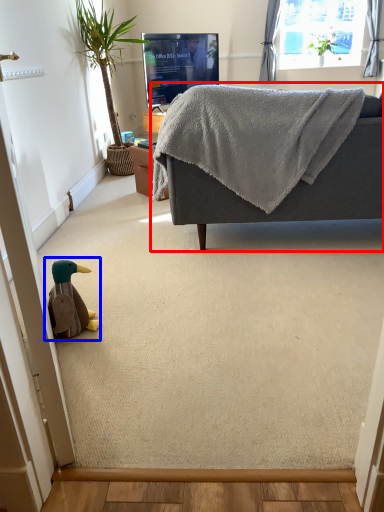
Question: Among these objects, which one is farthest to the camera, studio couch (highlighted by a red box) or toy (highlighted by a blue box)?

Choices:
 (A) studio couch
 (B) toy

Answer: (A)